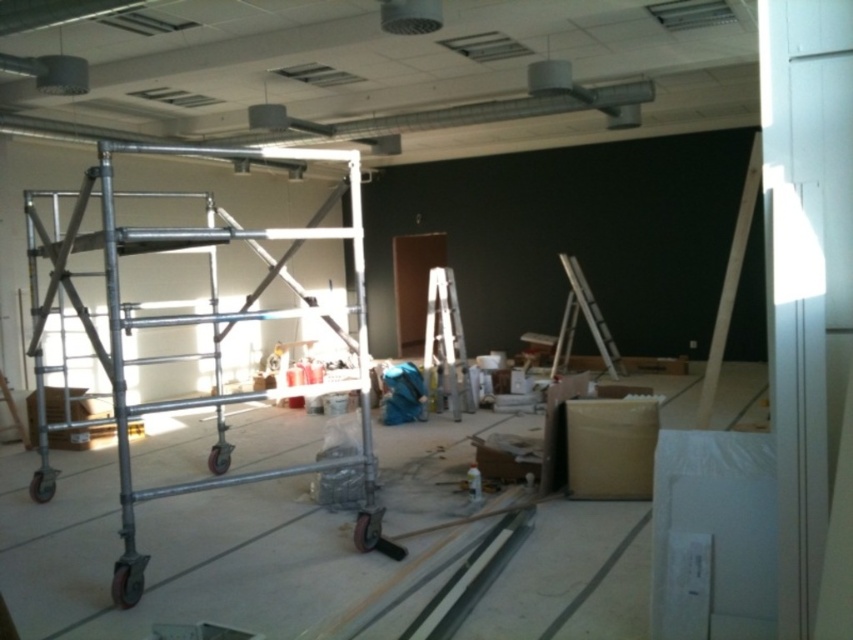
Is silver metallic scaffolding at left behind silver metallic ladder at center?

No, silver metallic scaffolding at left is in front of silver metallic ladder at center.

Who is more distant from viewer, (310, 300) or (448, 342)?

The point (448, 342) is behind.

Is point (221, 394) positioned behind point (448, 324)?

No.

Locate an element on the screen. The width and height of the screenshot is (853, 640). silver metallic scaffolding at left is located at coordinates (193, 323).

Is silver metallic ladder at center bigger than metallic silver ladder at center right?

Actually, silver metallic ladder at center might be smaller than metallic silver ladder at center right.

Is point (433, 276) positioned after point (587, 296)?

No, (433, 276) is in front of (587, 296).

Image resolution: width=853 pixels, height=640 pixels. In order to click on silver metallic ladder at center in this screenshot , I will do `click(445, 340)`.

Which is in front, point (126, 522) or point (570, 305)?

Point (126, 522) is in front.

What do you see at coordinates (193, 323) in the screenshot? I see `silver metallic scaffolding at left` at bounding box center [193, 323].

Is point (140, 588) closer to viewer compared to point (584, 296)?

Yes, point (140, 588) is closer to viewer.

Find the location of a particular element. silver metallic scaffolding at left is located at coordinates (193, 323).